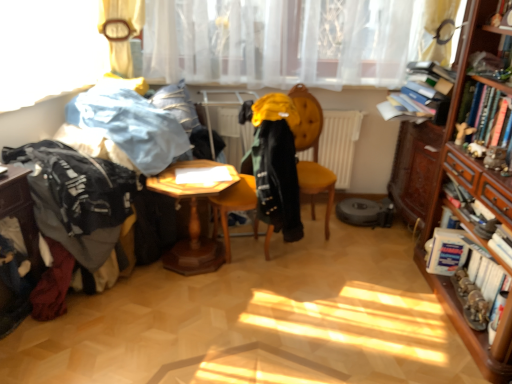
The width and height of the screenshot is (512, 384). Find the location of `free space in front of wooden hexagonal table at center, marked as the second table in a left-to-right arrangement`. free space in front of wooden hexagonal table at center, marked as the second table in a left-to-right arrangement is located at coordinates (188, 302).